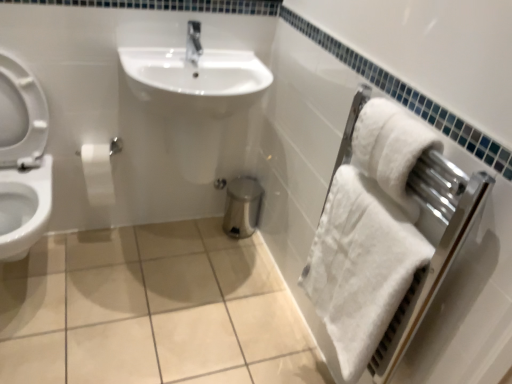
Question: Considering the relative sizes of white glossy toilet at left and white matte toilet paper at left in the image provided, is white glossy toilet at left thinner than white matte toilet paper at left?

Choices:
 (A) yes
 (B) no

Answer: (B)

Question: Can you confirm if white glossy toilet at left is positioned to the right of white matte toilet paper at left?

Choices:
 (A) yes
 (B) no

Answer: (B)

Question: Is white glossy toilet at left far from white matte toilet paper at left?

Choices:
 (A) no
 (B) yes

Answer: (A)

Question: From a real-world perspective, is white glossy toilet at left positioned over white matte toilet paper at left based on gravity?

Choices:
 (A) yes
 (B) no

Answer: (A)

Question: Can you confirm if white glossy toilet at left is wider than white matte toilet paper at left?

Choices:
 (A) yes
 (B) no

Answer: (A)

Question: Is white fluffy bath towel at right, the first bath towel in the bottom-to-top sequence, inside the boundaries of white soft towel at right, the 1th bath towel positioned from the top, or outside?

Choices:
 (A) inside
 (B) outside

Answer: (B)

Question: Considering the positions of point (329, 324) and point (380, 117), is point (329, 324) closer or farther from the camera than point (380, 117)?

Choices:
 (A) farther
 (B) closer

Answer: (A)

Question: Is white fluffy bath towel at right, the first bath towel in the bottom-to-top sequence, to the left or to the right of white soft towel at right, which appears as the second bath towel when ordered from the bottom, in the image?

Choices:
 (A) left
 (B) right

Answer: (A)

Question: From the image's perspective, is white fluffy bath towel at right, the first bath towel in the bottom-to-top sequence, located above or below white soft towel at right, the 1th bath towel positioned from the top?

Choices:
 (A) below
 (B) above

Answer: (A)

Question: Which is correct: white glossy toilet at left is inside beige ceramic tile at center, or outside of it?

Choices:
 (A) outside
 (B) inside

Answer: (A)

Question: Visually, is white glossy toilet at left positioned to the left or to the right of beige ceramic tile at center?

Choices:
 (A) right
 (B) left

Answer: (B)

Question: In terms of width, does white glossy toilet at left look wider or thinner when compared to beige ceramic tile at center?

Choices:
 (A) thin
 (B) wide

Answer: (A)

Question: In terms of size, does white glossy toilet at left appear bigger or smaller than beige ceramic tile at center?

Choices:
 (A) small
 (B) big

Answer: (B)

Question: Considering the positions of white fluffy bath towel at right, the first bath towel in the bottom-to-top sequence, and white soft towel at right in the image, is white fluffy bath towel at right, the first bath towel in the bottom-to-top sequence, bigger or smaller than white soft towel at right?

Choices:
 (A) small
 (B) big

Answer: (A)

Question: Does point (343, 294) appear closer or farther from the camera than point (395, 44)?

Choices:
 (A) farther
 (B) closer

Answer: (A)